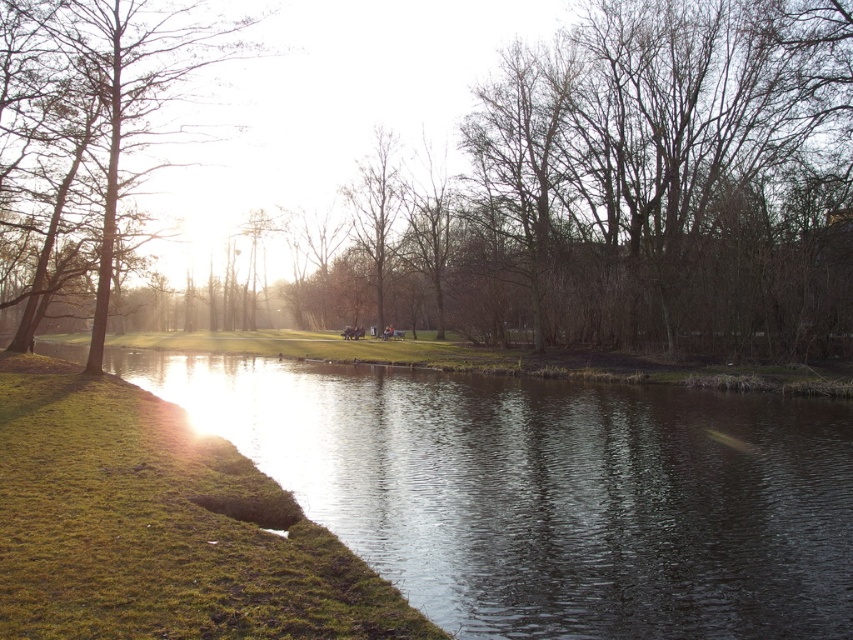
Question: Considering the real-world distances, which object is farthest from the brown leafless tree at left?

Choices:
 (A) green grassy river at lower left
 (B) brown textured tree at upper left

Answer: (A)

Question: Considering the relative positions of green grassy river at lower left and brown textured tree at upper left in the image provided, where is green grassy river at lower left located with respect to brown textured tree at upper left?

Choices:
 (A) above
 (B) below

Answer: (B)

Question: Which of the following is the farthest from the observer?

Choices:
 (A) brown leafless tree at left
 (B) green grassy river at lower left
 (C) brown textured tree at upper left

Answer: (A)

Question: Where is brown leafless tree at left located in relation to green grassy river at lower left in the image?

Choices:
 (A) above
 (B) below

Answer: (A)

Question: Can you confirm if green grassy river at lower left is thinner than brown textured tree at upper left?

Choices:
 (A) no
 (B) yes

Answer: (A)

Question: Which point is closer to the camera taking this photo?

Choices:
 (A) (82, 196)
 (B) (788, 474)

Answer: (B)